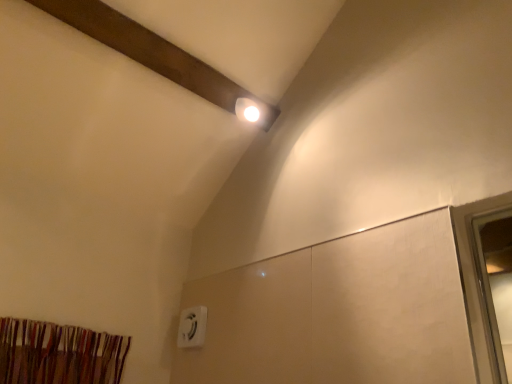
What is the approximate height of white plastic electric outlet at lower center?

6.81 inches.

I want to click on white plastic electric outlet at lower center, so click(x=192, y=327).

Describe the element at coordinates (192, 327) in the screenshot. This screenshot has height=384, width=512. I see `white plastic electric outlet at lower center` at that location.

Where is `striped fabric curtain at lower left`? The image size is (512, 384). striped fabric curtain at lower left is located at coordinates (59, 354).

What do you see at coordinates (59, 354) in the screenshot?
I see `striped fabric curtain at lower left` at bounding box center [59, 354].

Locate an element on the screen. This screenshot has width=512, height=384. white plastic electric outlet at lower center is located at coordinates (192, 327).

Is white plastic electric outlet at lower center to the left or to the right of striped fabric curtain at lower left in the image?

Clearly, white plastic electric outlet at lower center is on the right of striped fabric curtain at lower left in the image.

Considering the relative positions of white plastic electric outlet at lower center and striped fabric curtain at lower left in the image provided, is white plastic electric outlet at lower center behind striped fabric curtain at lower left?

Yes, white plastic electric outlet at lower center is further from the camera.

Between point (199, 328) and point (54, 372), which one is positioned in front?

Point (54, 372)

From the image's perspective, is white plastic electric outlet at lower center located beneath striped fabric curtain at lower left?

Yes, from the image's perspective, white plastic electric outlet at lower center is beneath striped fabric curtain at lower left.

From a real-world perspective, does white plastic electric outlet at lower center stand above striped fabric curtain at lower left?

Indeed, from a real-world perspective, white plastic electric outlet at lower center stands above striped fabric curtain at lower left.

From the picture: Considering the relative sizes of white plastic electric outlet at lower center and striped fabric curtain at lower left in the image provided, is white plastic electric outlet at lower center thinner than striped fabric curtain at lower left?

Yes.

Is white plastic electric outlet at lower center shorter than striped fabric curtain at lower left?

No, white plastic electric outlet at lower center is not shorter than striped fabric curtain at lower left.

Between white plastic electric outlet at lower center and striped fabric curtain at lower left, which one has smaller size?

With smaller size is white plastic electric outlet at lower center.

Is striped fabric curtain at lower left located within white plastic electric outlet at lower center?

No.

Is white plastic electric outlet at lower center next to striped fabric curtain at lower left and touching it?

No, white plastic electric outlet at lower center is not beside striped fabric curtain at lower left.

Is striped fabric curtain at lower left at the back of white plastic electric outlet at lower center?

No, striped fabric curtain at lower left is not at the back of white plastic electric outlet at lower center.

Measure the distance between white plastic electric outlet at lower center and striped fabric curtain at lower left.

The distance of white plastic electric outlet at lower center from striped fabric curtain at lower left is 16.76 inches.

The width and height of the screenshot is (512, 384). I want to click on curtain that is on the left side of white plastic electric outlet at lower center, so click(59, 354).

Considering the positions of objects striped fabric curtain at lower left and white plastic electric outlet at lower center in the image provided, who is more to the left, striped fabric curtain at lower left or white plastic electric outlet at lower center?

striped fabric curtain at lower left.

Which object is closer to the camera taking this photo, striped fabric curtain at lower left or white plastic electric outlet at lower center?

Positioned in front is striped fabric curtain at lower left.

Considering the points (123, 352) and (204, 311), which point is in front, point (123, 352) or point (204, 311)?

Positioned in front is point (123, 352).

From the image's perspective, relative to white plastic electric outlet at lower center, is striped fabric curtain at lower left above or below?

From the image's perspective, striped fabric curtain at lower left appears above white plastic electric outlet at lower center.

From a real-world perspective, which object stands above the other?

white plastic electric outlet at lower center is physically above.

Can you confirm if striped fabric curtain at lower left is thinner than white plastic electric outlet at lower center?

No, striped fabric curtain at lower left is not thinner than white plastic electric outlet at lower center.

Between striped fabric curtain at lower left and white plastic electric outlet at lower center, which one has less height?

striped fabric curtain at lower left is shorter.

Is striped fabric curtain at lower left bigger than white plastic electric outlet at lower center?

Yes, striped fabric curtain at lower left is bigger than white plastic electric outlet at lower center.

Is striped fabric curtain at lower left completely or partially outside of white plastic electric outlet at lower center?

Yes, striped fabric curtain at lower left is not within white plastic electric outlet at lower center.

Is striped fabric curtain at lower left far away from white plastic electric outlet at lower center?

No, striped fabric curtain at lower left is not far from white plastic electric outlet at lower center.

Is striped fabric curtain at lower left positioned with its back to white plastic electric outlet at lower center?

That's not correct — striped fabric curtain at lower left is not looking away from white plastic electric outlet at lower center.

How different are the orientations of striped fabric curtain at lower left and white plastic electric outlet at lower center in degrees?

The angular difference between striped fabric curtain at lower left and white plastic electric outlet at lower center is 91.4 degrees.

This screenshot has height=384, width=512. I want to click on electric outlet lying behind the striped fabric curtain at lower left, so click(192, 327).

The height and width of the screenshot is (384, 512). In order to click on curtain that appears in front of the white plastic electric outlet at lower center in this screenshot , I will do `click(59, 354)`.

Locate an element on the screen. The height and width of the screenshot is (384, 512). electric outlet behind the striped fabric curtain at lower left is located at coordinates (192, 327).